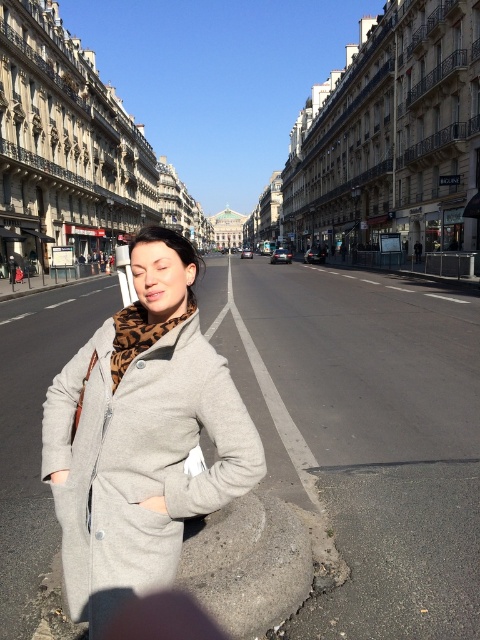
Who is lower down, gray wool coat at center or smooth concrete curb at lower center?

smooth concrete curb at lower center

Does gray wool coat at center have a greater height compared to smooth concrete curb at lower center?

Yes, gray wool coat at center is taller than smooth concrete curb at lower center.

Image resolution: width=480 pixels, height=640 pixels. Describe the element at coordinates (142, 436) in the screenshot. I see `gray wool coat at center` at that location.

You are a GUI agent. You are given a task and a screenshot of the screen. Output one action in this format:
    pyautogui.click(x=<x>, y=<y>)
    Task: Click on the gray wool coat at center
    Image resolution: width=480 pixels, height=640 pixels.
    Given the screenshot: What is the action you would take?
    pyautogui.click(x=142, y=436)